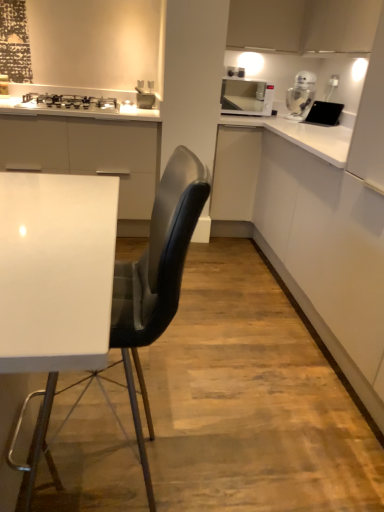
Question: Is white glossy microwave at upper right aimed at black leather chair at center?

Choices:
 (A) no
 (B) yes

Answer: (B)

Question: Does white glossy microwave at upper right have a greater height compared to black leather chair at center?

Choices:
 (A) no
 (B) yes

Answer: (A)

Question: From a real-world perspective, is white glossy microwave at upper right below black leather chair at center?

Choices:
 (A) yes
 (B) no

Answer: (B)

Question: Considering the relative sizes of white glossy microwave at upper right and black leather chair at center in the image provided, is white glossy microwave at upper right bigger than black leather chair at center?

Choices:
 (A) yes
 (B) no

Answer: (B)

Question: Considering the relative sizes of white glossy microwave at upper right and black leather chair at center in the image provided, is white glossy microwave at upper right shorter than black leather chair at center?

Choices:
 (A) yes
 (B) no

Answer: (A)

Question: From the image's perspective, relative to silver metallic gas stove at upper left, is clear glass jar at upper right above or below?

Choices:
 (A) below
 (B) above

Answer: (B)

Question: From a real-world perspective, relative to silver metallic gas stove at upper left, is clear glass jar at upper right vertically above or below?

Choices:
 (A) above
 (B) below

Answer: (A)

Question: Considering their positions, is clear glass jar at upper right located in front of or behind silver metallic gas stove at upper left?

Choices:
 (A) front
 (B) behind

Answer: (B)

Question: In the image, is clear glass jar at upper right on the left side or the right side of silver metallic gas stove at upper left?

Choices:
 (A) right
 (B) left

Answer: (A)

Question: In the image, is silver metallic gas stove at upper left positioned in front of or behind white glossy microwave at upper right?

Choices:
 (A) front
 (B) behind

Answer: (A)

Question: Considering the positions of silver metallic gas stove at upper left and white glossy microwave at upper right in the image, is silver metallic gas stove at upper left taller or shorter than white glossy microwave at upper right?

Choices:
 (A) tall
 (B) short

Answer: (B)

Question: Looking at the image, does silver metallic gas stove at upper left seem bigger or smaller compared to white glossy microwave at upper right?

Choices:
 (A) big
 (B) small

Answer: (B)

Question: Is silver metallic gas stove at upper left wider or thinner than white glossy microwave at upper right?

Choices:
 (A) thin
 (B) wide

Answer: (B)

Question: Considering the positions of point (147, 307) and point (317, 110), is point (147, 307) closer or farther from the camera than point (317, 110)?

Choices:
 (A) closer
 (B) farther

Answer: (A)

Question: Considering their positions, is black leather chair at center located in front of or behind black matte tablet at upper right?

Choices:
 (A) behind
 (B) front

Answer: (B)